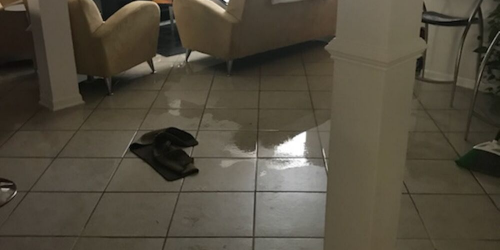
The width and height of the screenshot is (500, 250). I want to click on dry side of floor, so click(221, 209), click(290, 179), click(203, 180), click(152, 203), click(136, 178), click(96, 167), click(96, 151).